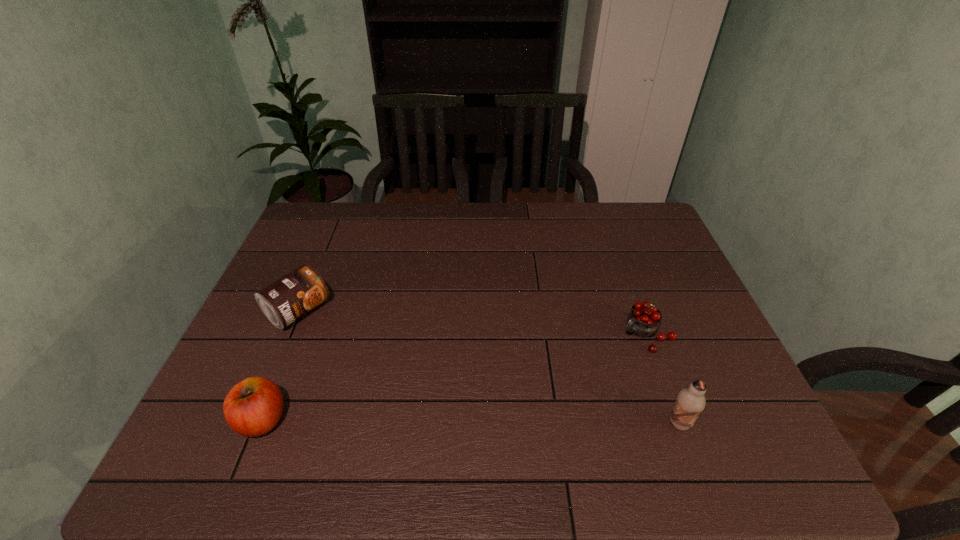
You are a GUI agent. You are given a task and a screenshot of the screen. Output one action in this format:
    pyautogui.click(x=<x>, y=<y>)
    Task: Click on the empty space that is in between the pot filled with cherries and the apple
    Image resolution: width=960 pixels, height=540 pixels.
    Given the screenshot: What is the action you would take?
    point(454,377)

The width and height of the screenshot is (960, 540). In order to click on empty space between the pot filled with cherries and the can in this screenshot , I will do `click(472, 323)`.

This screenshot has height=540, width=960. In order to click on empty space between the pot filled with cherries and the can in this screenshot , I will do `click(472, 323)`.

Identify the location of free space that is in between the pot filled with cherries and the chocolate milk. (662, 379).

I want to click on empty space that is in between the pot filled with cherries and the tallest object, so click(x=662, y=379).

Identify which object is the second nearest to the pot filled with cherries. Please provide its 2D coordinates. Your answer should be formatted as a tuple, i.e. [(x, y)], where the tuple contains the x and y coordinates of a point satisfying the conditions above.

[(284, 301)]

Select which object is the third closest to the pot filled with cherries. Please provide its 2D coordinates. Your answer should be formatted as a tuple, i.e. [(x, y)], where the tuple contains the x and y coordinates of a point satisfying the conditions above.

[(253, 407)]

You are a GUI agent. You are given a task and a screenshot of the screen. Output one action in this format:
    pyautogui.click(x=<x>, y=<y>)
    Task: Click on the vacant point that satisfies the following two spatial constraints: 1. on the front side of the can; 2. on the right side of the pot filled with cherries
    The width and height of the screenshot is (960, 540).
    Given the screenshot: What is the action you would take?
    pyautogui.click(x=288, y=335)